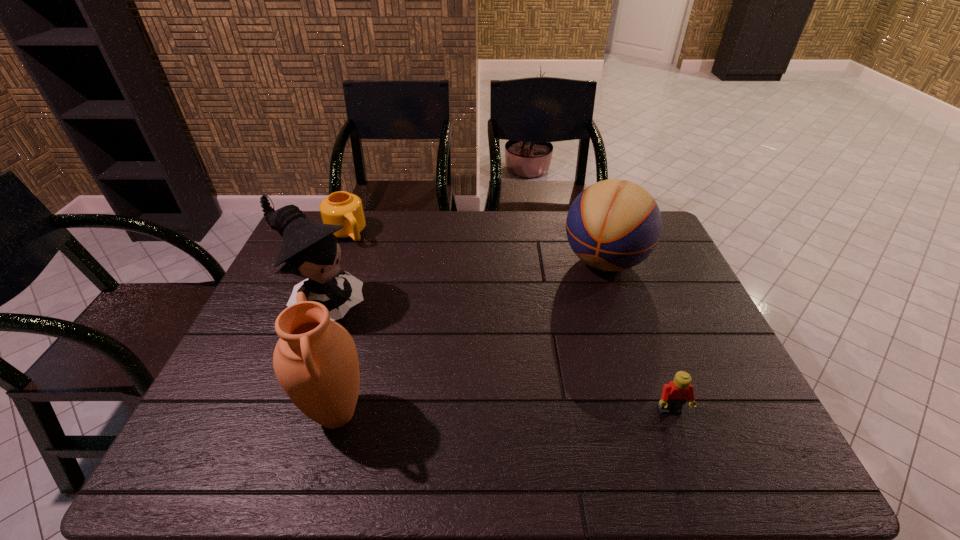
This screenshot has height=540, width=960. What are the coordinates of `mug that is at the left edge` in the screenshot? It's located at (342, 208).

Find the location of a particular element. Lego situated at the right edge is located at coordinates (674, 395).

This screenshot has height=540, width=960. What are the coordinates of `basketball that is at the right edge` in the screenshot? It's located at (613, 225).

Find the location of a particular element. The image size is (960, 540). object at the far left corner is located at coordinates tap(342, 208).

The image size is (960, 540). In order to click on object present at the far right corner in this screenshot , I will do `click(613, 225)`.

You are a GUI agent. You are given a task and a screenshot of the screen. Output one action in this format:
    pyautogui.click(x=<x>, y=<y>)
    Task: Click on the object present at the near right corner
    The width and height of the screenshot is (960, 540).
    Given the screenshot: What is the action you would take?
    pyautogui.click(x=674, y=395)

The height and width of the screenshot is (540, 960). In the image, there is a desktop. What are the coordinates of `vacant space at the far edge` in the screenshot? It's located at (463, 218).

This screenshot has height=540, width=960. Find the location of `vacant space at the near edge of the desktop`. vacant space at the near edge of the desktop is located at coordinates (444, 401).

The width and height of the screenshot is (960, 540). Find the location of `vacant space at the left edge of the desktop`. vacant space at the left edge of the desktop is located at coordinates (242, 357).

Where is `vacant space at the right edge of the desktop`? The height and width of the screenshot is (540, 960). vacant space at the right edge of the desktop is located at coordinates (662, 308).